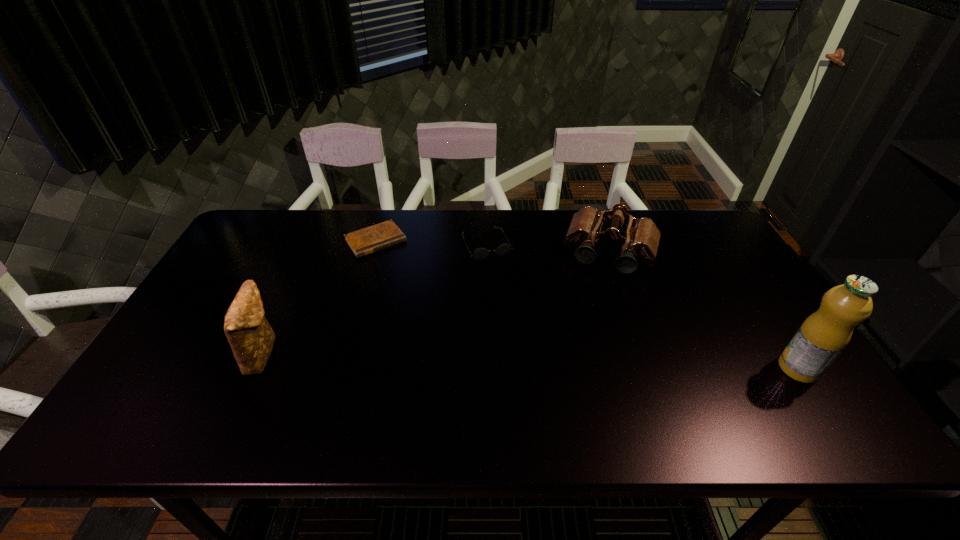
Where is `free location located on the open side of the leftmost object`? free location located on the open side of the leftmost object is located at coordinates (342, 353).

Where is `blank space located on the front label of the fruit juice`? The width and height of the screenshot is (960, 540). blank space located on the front label of the fruit juice is located at coordinates (755, 368).

Locate an element on the screen. free space located 0.050m on the front label of the fruit juice is located at coordinates coord(759,368).

Locate an element on the screen. free region located 0.130m on the front label of the fruit juice is located at coordinates (726, 368).

This screenshot has height=540, width=960. In order to click on vacant space situated 0.280m on the front-facing side of the fourth tallest object in this screenshot , I will do `click(527, 328)`.

At what (x,y) coordinates should I click in order to perform the action: click on vacant space located 0.210m on the front-facing side of the fourth tallest object. Please return your answer as a coordinate pair (x, y). The width and height of the screenshot is (960, 540). Looking at the image, I should click on (518, 309).

Find the location of a particular element. vacant space located 0.360m on the front-facing side of the fourth tallest object is located at coordinates (539, 350).

You are a GUI agent. You are given a task and a screenshot of the screen. Output one action in this format:
    pyautogui.click(x=<x>, y=<y>)
    Task: Click on the vacant area situated 0.170m on the spine side of the diary
    
    Given the screenshot: What is the action you would take?
    pyautogui.click(x=412, y=287)

Find the location of `vacant space positioned on the spine side of the diary`. vacant space positioned on the spine side of the diary is located at coordinates (444, 329).

Find the location of a particular element. The height and width of the screenshot is (540, 960). free space located on the spine side of the diary is located at coordinates (417, 293).